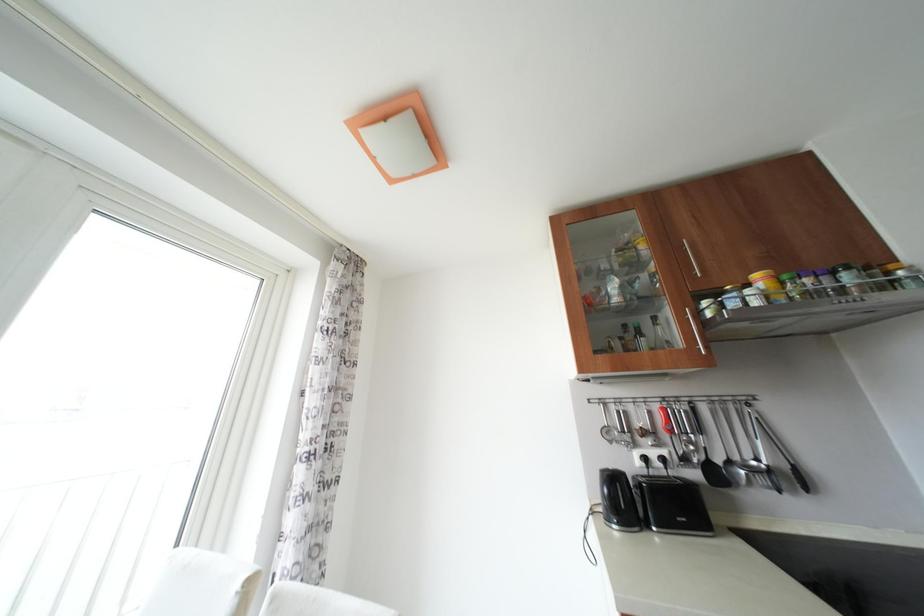
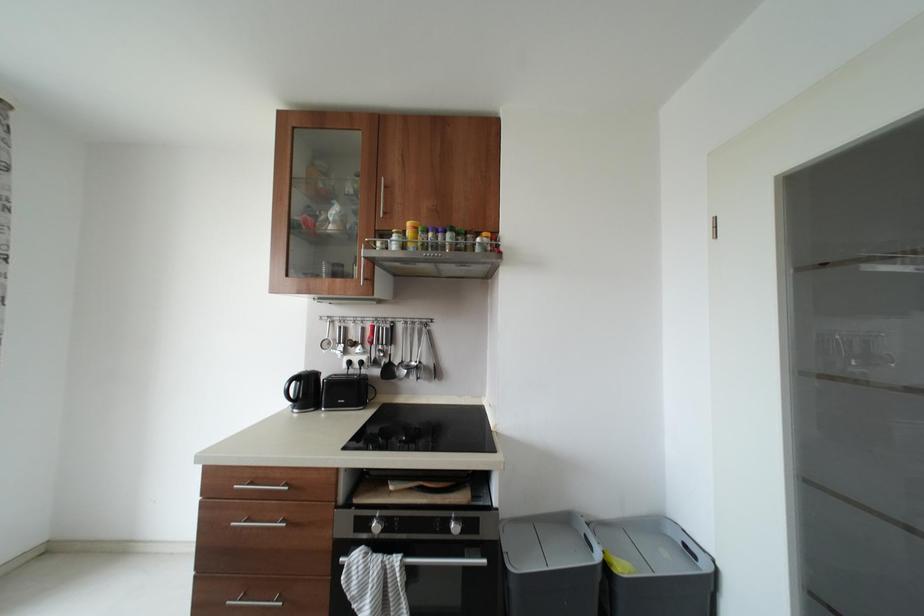
Question: In a continuous first-person perspective shot, in which direction is the camera moving?

Choices:
 (A) Left
 (B) Right
 (C) Forward
 (D) Backward

Answer: (B)